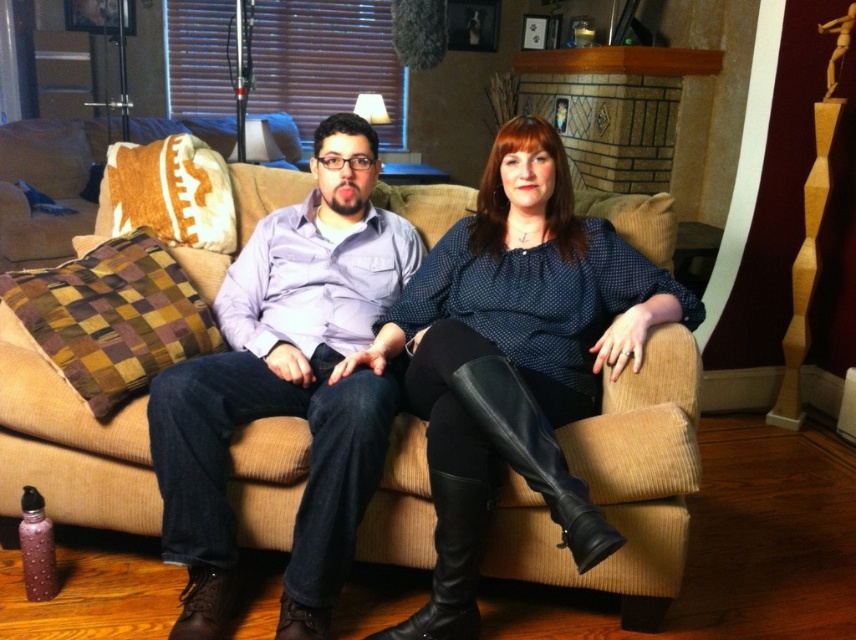
Question: Considering the relative positions of matte black boots at center and matte purple shirt at center in the image provided, where is matte black boots at center located with respect to matte purple shirt at center?

Choices:
 (A) above
 (B) below

Answer: (B)

Question: Which object is the closest to the matte purple shirt at center?

Choices:
 (A) beige corduroy couch at center
 (B) brown checkered pillow at left

Answer: (A)

Question: Is beige corduroy couch at center further to camera compared to matte purple shirt at center?

Choices:
 (A) yes
 (B) no

Answer: (A)

Question: Is beige corduroy couch at center closer to the viewer compared to matte purple shirt at center?

Choices:
 (A) no
 (B) yes

Answer: (A)

Question: Estimate the real-world distances between objects in this image. Which object is farther from the brown checkered pillow at left?

Choices:
 (A) matte purple shirt at center
 (B) beige corduroy couch at center

Answer: (B)

Question: Which point appears farthest from the camera in this image?

Choices:
 (A) (233, 324)
 (B) (64, 477)
 (C) (86, 161)

Answer: (C)